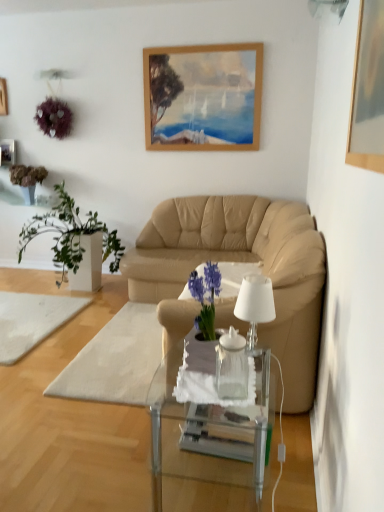
Question: In the image, is white fabric footrest at center on the left side or the right side of wooden picture frame at upper left, the 1th picture frame when ordered from top to bottom?

Choices:
 (A) right
 (B) left

Answer: (A)

Question: In the image, is white fabric footrest at center positioned in front of or behind wooden picture frame at upper left, the 3th picture frame ordered from the bottom?

Choices:
 (A) behind
 (B) front

Answer: (B)

Question: Based on their relative distances, which object is nearer to the white fabric footrest at center?

Choices:
 (A) beige leather couch at center
 (B) wooden picture frame at upper right, placed as the first picture frame when sorted from bottom to top
 (C) metallic silver picture frame at upper left, which is counted as the 2th picture frame, starting from the top
 (D) white rug at lower left
 (E) white glass lamp at center

Answer: (D)

Question: Which object is the closest to the green leafy plant at upper left, positioned as the 1th houseplant in left-to-right order?

Choices:
 (A) wooden picture frame at upper right, the 3th picture frame from the back
 (B) wooden picture frame at upper left, the 1th picture frame when ordered from top to bottom
 (C) white rug at lower left
 (D) green leafy plant at left, which appears as the second houseplant when viewed from the left
 (E) metallic silver picture frame at upper left, the second picture frame from the bottom

Answer: (E)